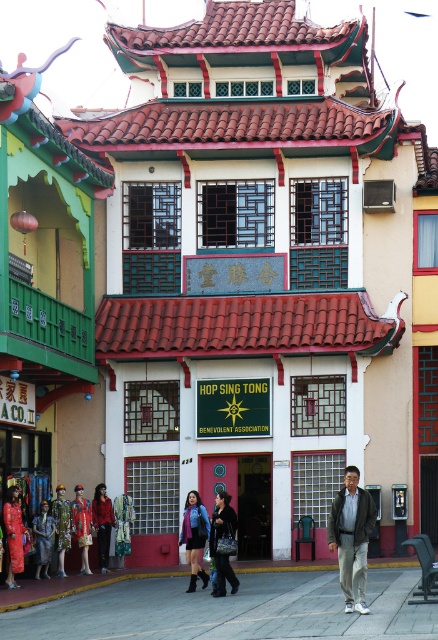
Is matte purple jacket at center smaller than matte red dress at lower left?

Yes.

Which of these two, matte purple jacket at center or matte red dress at lower left, stands shorter?

Standing shorter between the two is matte purple jacket at center.

Identify the location of matte purple jacket at center. The image size is (438, 640). (194, 536).

How much distance is there between matte green dress at lower left and silk dress at center?

The distance of matte green dress at lower left from silk dress at center is 1.30 meters.

The width and height of the screenshot is (438, 640). What do you see at coordinates (60, 529) in the screenshot? I see `matte green dress at lower left` at bounding box center [60, 529].

You are a GUI agent. You are given a task and a screenshot of the screen. Output one action in this format:
    pyautogui.click(x=<x>, y=<y>)
    Task: Click on the matte green dress at lower left
    
    Given the screenshot: What is the action you would take?
    pyautogui.click(x=60, y=529)

Is matte red dress at lower left wider than red velvet coat at center?

In fact, matte red dress at lower left might be narrower than red velvet coat at center.

Between matte red dress at lower left and red velvet coat at center, which one has more height?

matte red dress at lower left is taller.

Image resolution: width=438 pixels, height=640 pixels. Identify the location of matte red dress at lower left. pyautogui.click(x=14, y=536).

At what (x,y) coordinates should I click in order to perform the action: click on matte red dress at lower left. Please return your answer as a coordinate pair (x, y). Image resolution: width=438 pixels, height=640 pixels. Looking at the image, I should click on (14, 536).